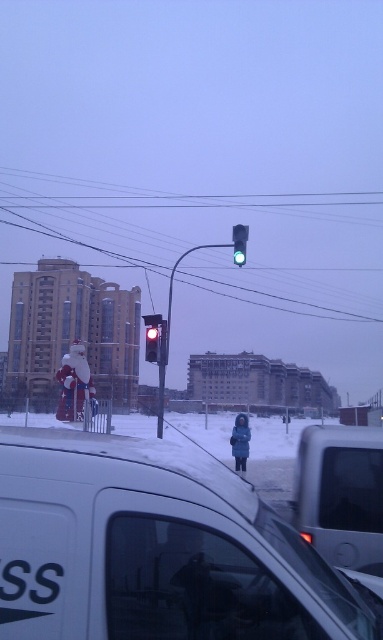
Question: Does white plush santa at center appear on the left side of green glass traffic light at center?

Choices:
 (A) no
 (B) yes

Answer: (B)

Question: Which of these objects is positioned farthest from the matte glass traffic light at center?

Choices:
 (A) blue matte coat at center
 (B) white plush santa at center
 (C) white matte van at lower left

Answer: (B)

Question: Is the position of matte glass traffic light at center less distant than that of red glass traffic light at center?

Choices:
 (A) yes
 (B) no

Answer: (A)

Question: Which point is closer to the camera?

Choices:
 (A) blue matte coat at center
 (B) red glass traffic light at center

Answer: (B)

Question: Which is nearer to the red glass traffic light at center?

Choices:
 (A) green glass traffic light at center
 (B) white matte van at center
 (C) white plush santa at center

Answer: (A)

Question: Is white matte van at lower left wider than matte glass traffic light at center?

Choices:
 (A) yes
 (B) no

Answer: (A)